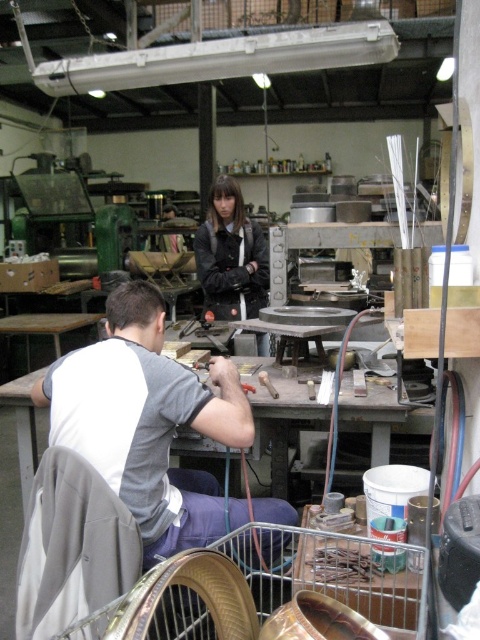
Question: Is matte black jacket at center below metallic hammer at center?

Choices:
 (A) no
 (B) yes

Answer: (A)

Question: Does metallic red-handled screwdriver at center have a lesser width compared to metallic hammer at center?

Choices:
 (A) yes
 (B) no

Answer: (B)

Question: Which of the following is the farthest from the observer?

Choices:
 (A) matte black jacket at center
 (B) gray cotton shirt at center
 (C) metallic hammer at center

Answer: (A)

Question: Which object is the closest to the metallic silver tool at center?

Choices:
 (A) metallic hammer at center
 (B) metallic red-handled screwdriver at center

Answer: (B)

Question: Estimate the real-world distances between objects in this image. Which object is farther from the metallic hammer at center?

Choices:
 (A) matte black jacket at center
 (B) metallic silver tool at center

Answer: (A)

Question: Where is matte black jacket at center located in relation to metallic hammer at center in the image?

Choices:
 (A) right
 (B) left

Answer: (B)